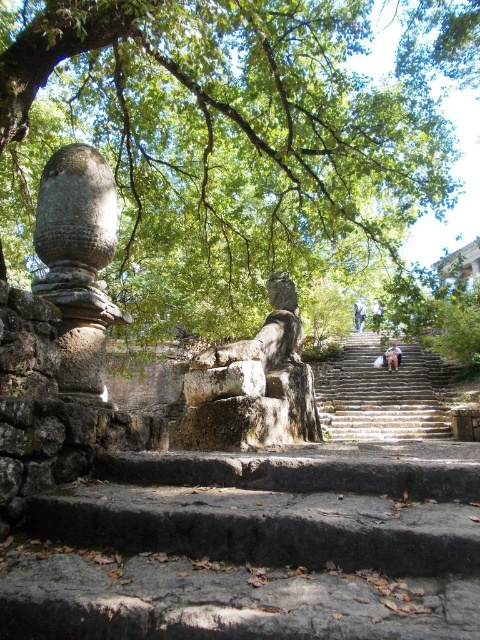
Which is in front, point (415, 134) or point (416, 426)?

Positioned in front is point (415, 134).

Does green leafy tree at upper center appear on the left side of stone textured stairs at center?

Correct, you'll find green leafy tree at upper center to the left of stone textured stairs at center.

The height and width of the screenshot is (640, 480). I want to click on green leafy tree at upper center, so click(x=240, y=147).